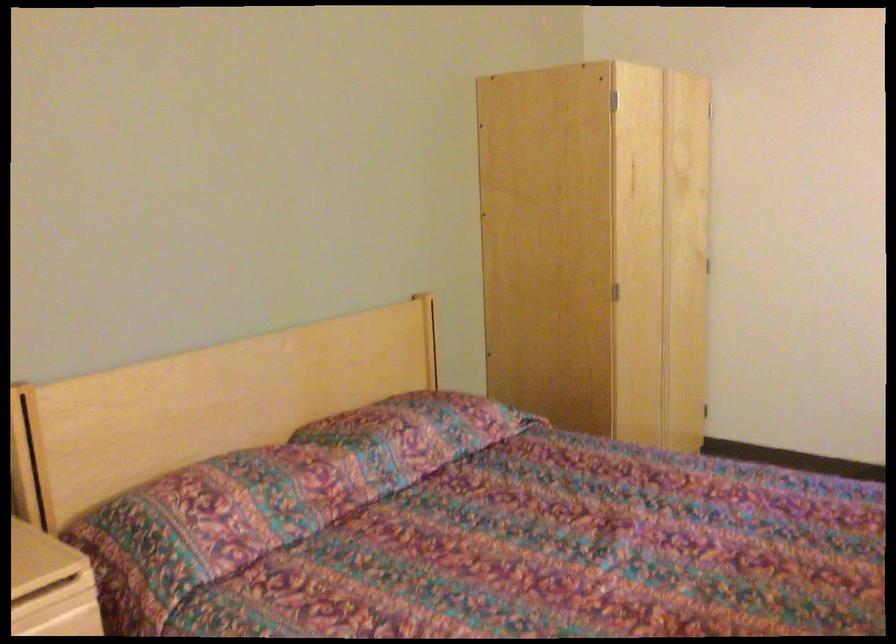
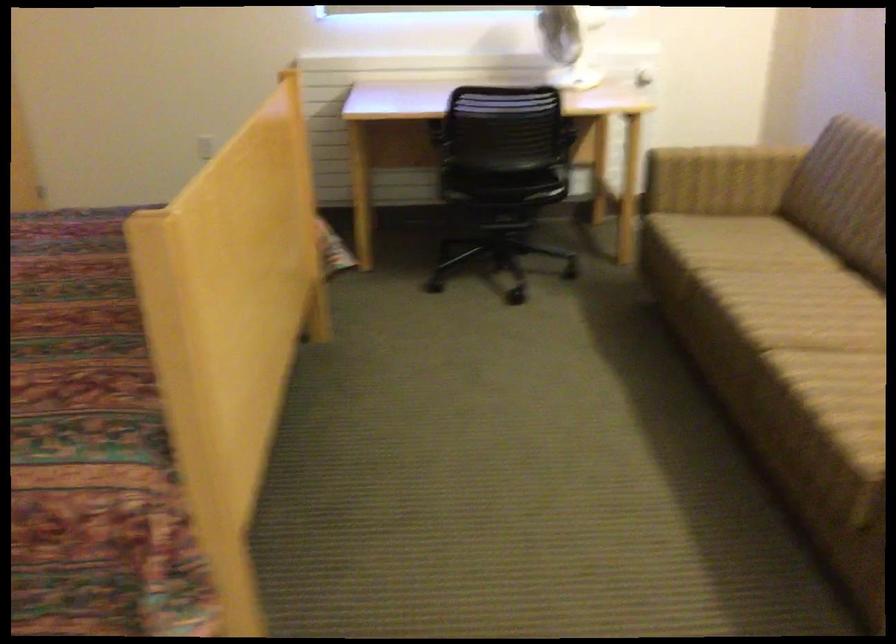
Question: How did the camera likely rotate?

Choices:
 (A) Left
 (B) Right
 (C) Up
 (D) Down

Answer: (B)